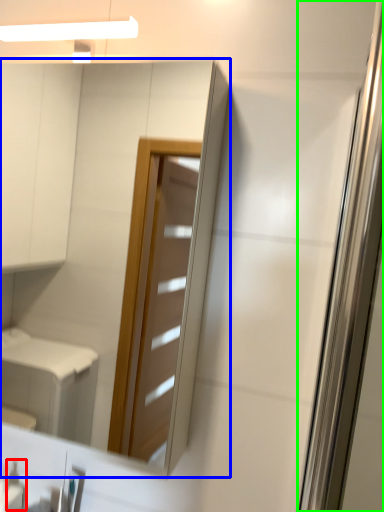
Question: Estimate the real-world distances between objects in this image. Which object is farther from toiletry (highlighted by a red box), mirror (highlighted by a blue box) or screen door (highlighted by a green box)?

Choices:
 (A) mirror
 (B) screen door

Answer: (A)